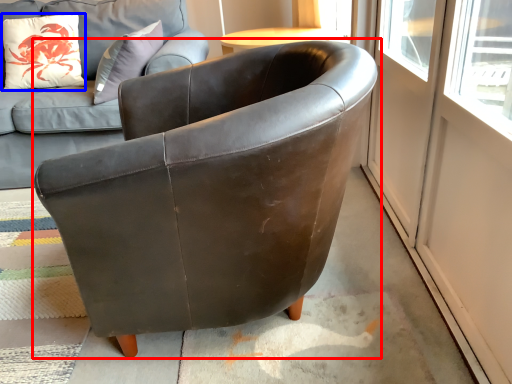
Question: Among these objects, which one is farthest to the camera, chair (highlighted by a red box) or pillow (highlighted by a blue box)?

Choices:
 (A) chair
 (B) pillow

Answer: (B)